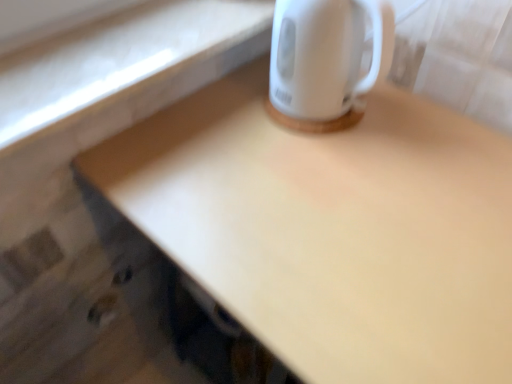
Question: From a real-world perspective, is matte white desk at upper right physically located above or below white glossy electric kettle at upper right?

Choices:
 (A) above
 (B) below

Answer: (B)

Question: Is matte white desk at upper right situated inside white glossy electric kettle at upper right or outside?

Choices:
 (A) outside
 (B) inside

Answer: (A)

Question: Is matte white desk at upper right bigger or smaller than white glossy electric kettle at upper right?

Choices:
 (A) small
 (B) big

Answer: (B)

Question: Does point [x=274, y=67] appear closer or farther from the camera than point [x=384, y=246]?

Choices:
 (A) farther
 (B) closer

Answer: (A)

Question: From the image's perspective, relative to matte white desk at upper right, is white glossy electric kettle at upper right above or below?

Choices:
 (A) below
 (B) above

Answer: (B)

Question: Is white glossy electric kettle at upper right inside or outside of matte white desk at upper right?

Choices:
 (A) inside
 (B) outside

Answer: (B)

Question: Considering the relative positions of white glossy electric kettle at upper right and matte white desk at upper right in the image provided, is white glossy electric kettle at upper right to the left or to the right of matte white desk at upper right?

Choices:
 (A) right
 (B) left

Answer: (B)